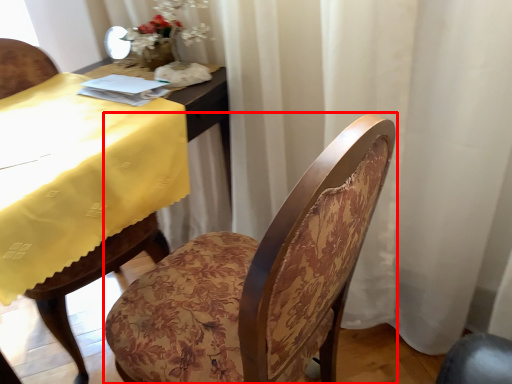
Question: From the image's perspective, where is chair (annotated by the red box) located in relation to table in the image?

Choices:
 (A) above
 (B) below

Answer: (B)